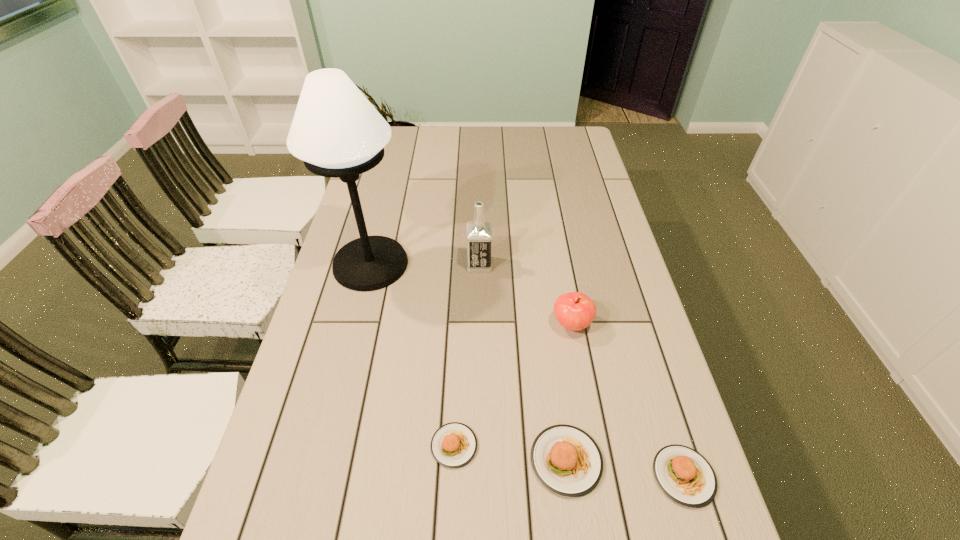
Locate an element on the screen. The image size is (960, 540). object that is at the near right corner is located at coordinates (684, 475).

In the image, there is a desktop. Where is `vacant region at the far edge`? The image size is (960, 540). vacant region at the far edge is located at coordinates (445, 138).

You are a GUI agent. You are given a task and a screenshot of the screen. Output one action in this format:
    pyautogui.click(x=<x>, y=<y>)
    Task: Click on the free region at the right edge
    
    Given the screenshot: What is the action you would take?
    pyautogui.click(x=642, y=395)

At what (x,y) coordinates should I click in order to perform the action: click on vacant space at the far left corner. Please return your answer as a coordinate pair (x, y). The width and height of the screenshot is (960, 540). Looking at the image, I should click on (412, 131).

The image size is (960, 540). In the image, there is a desktop. Identify the location of vacant space at the near left corner. (245, 535).

At what (x,y) coordinates should I click in order to perform the action: click on vacant space at the far right corner of the desktop. Please return your answer as a coordinate pair (x, y). The image size is (960, 540). Looking at the image, I should click on (548, 141).

Find the location of a particular element. free region at the near right corner of the desktop is located at coordinates (674, 519).

Where is `vacant area that lies between the shortest object and the table lamp`? vacant area that lies between the shortest object and the table lamp is located at coordinates (413, 355).

The height and width of the screenshot is (540, 960). What are the coordinates of `free spot between the tallest object and the fourth nearest object` in the screenshot? It's located at (471, 294).

I want to click on empty space that is in between the tallest food and the table lamp, so click(x=468, y=362).